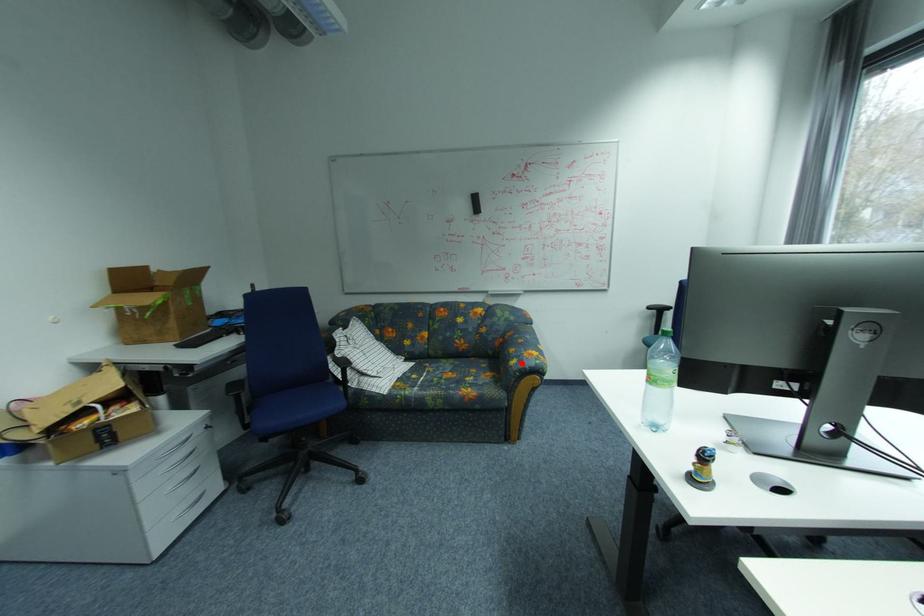
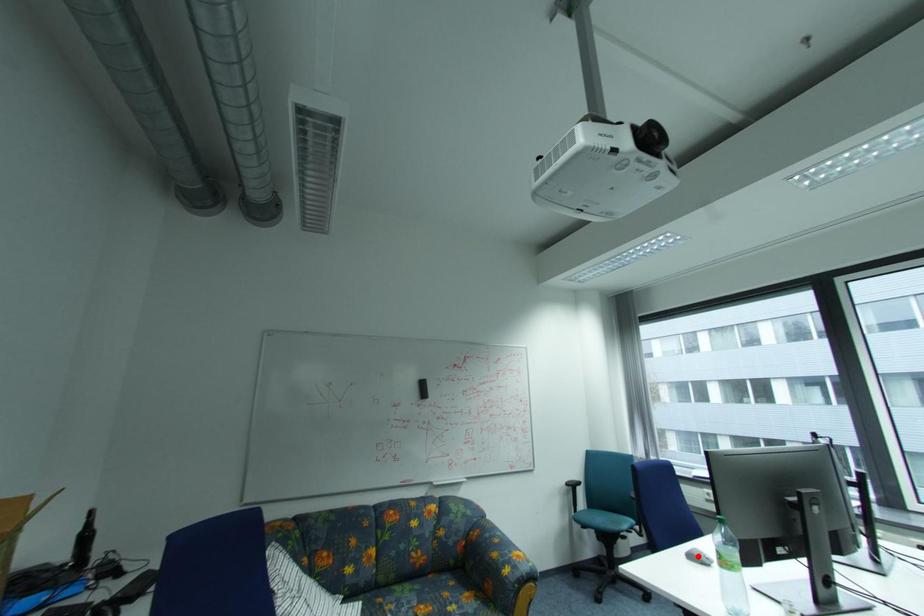
I am providing you with two images of the same scene from different viewpoints. A red point is marked on the first image and another point is marked on the second image. Are the points marked in image1 and image2 representing the same 3D position?

No